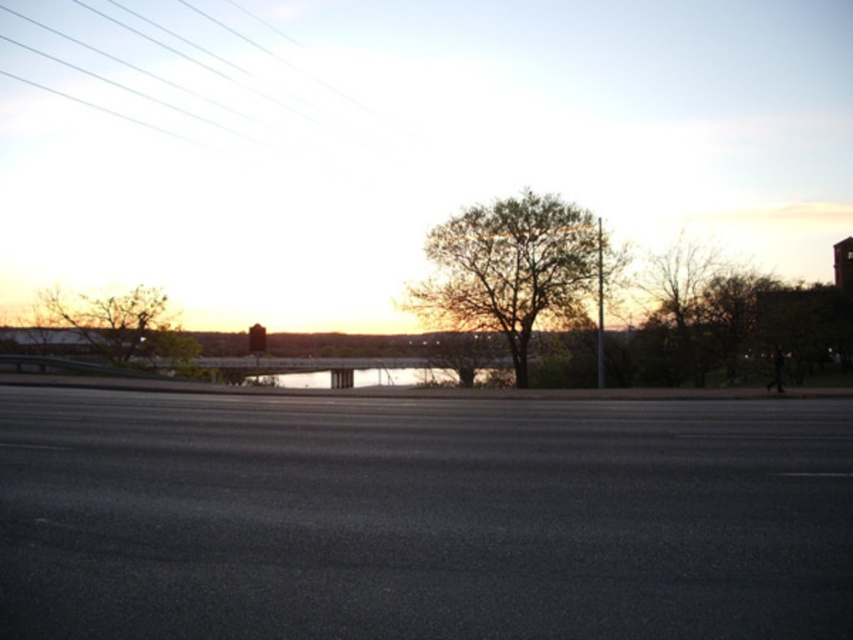
Is point (247, 97) less distant than point (461, 250)?

That is False.

Who is positioned more to the left, clear glass power lines at upper left or green leafy tree at center?

clear glass power lines at upper left is more to the left.

Describe the element at coordinates (204, 90) in the screenshot. I see `clear glass power lines at upper left` at that location.

The image size is (853, 640). Find the location of `clear glass power lines at upper left`. clear glass power lines at upper left is located at coordinates (204, 90).

Does green leafy tree at center appear over green leafy tree at left?

Yes, green leafy tree at center is above green leafy tree at left.

Based on the photo, how distant is green leafy tree at center from green leafy tree at left?

green leafy tree at center and green leafy tree at left are 65.66 feet apart.

Identify the location of green leafy tree at center. Image resolution: width=853 pixels, height=640 pixels. (509, 269).

Between green leafy tree at left and bare branches at right, which one appears on the right side from the viewer's perspective?

bare branches at right

You are a GUI agent. You are given a task and a screenshot of the screen. Output one action in this format:
    pyautogui.click(x=<x>, y=<y>)
    Task: Click on the green leafy tree at left
    This screenshot has width=853, height=640.
    Given the screenshot: What is the action you would take?
    pyautogui.click(x=122, y=324)